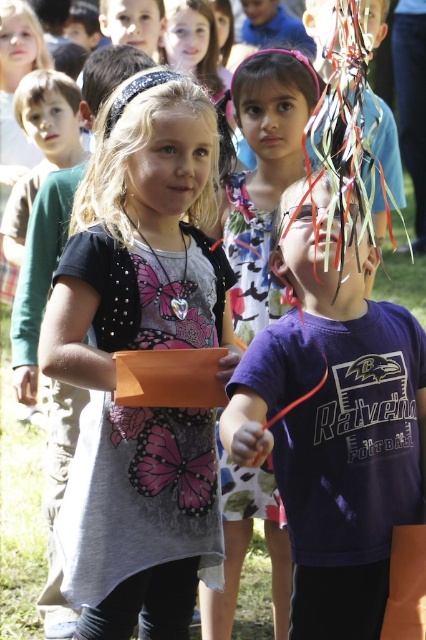
Question: Which point is closer to the camera?

Choices:
 (A) matte gray dress at center
 (B) purple cotton shirt at center

Answer: (B)

Question: Is matte gray dress at center closer to camera compared to purple cotton shirt at center?

Choices:
 (A) yes
 (B) no

Answer: (B)

Question: Does matte gray dress at center lie behind purple cotton shirt at center?

Choices:
 (A) no
 (B) yes

Answer: (B)

Question: Can you confirm if matte gray dress at center is wider than purple cotton shirt at center?

Choices:
 (A) no
 (B) yes

Answer: (A)